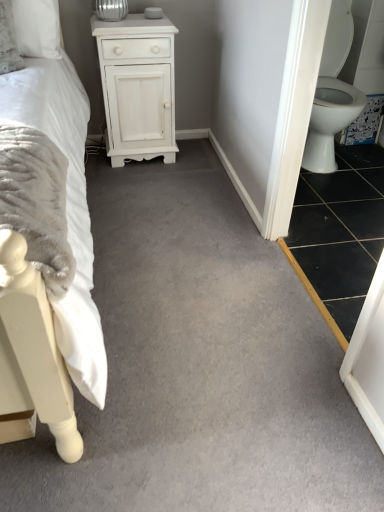
Question: Is white soft bed at left smaller than black tile at lower right?

Choices:
 (A) yes
 (B) no

Answer: (B)

Question: Is white soft bed at left not inside black tile at lower right?

Choices:
 (A) no
 (B) yes

Answer: (B)

Question: Is white soft bed at left thinner than black tile at lower right?

Choices:
 (A) yes
 (B) no

Answer: (B)

Question: Can you confirm if white soft bed at left is positioned to the right of black tile at lower right?

Choices:
 (A) yes
 (B) no

Answer: (B)

Question: From a real-world perspective, is white soft bed at left under black tile at lower right?

Choices:
 (A) yes
 (B) no

Answer: (B)

Question: Considering the relative positions of white soft bed at left and black tile at lower right in the image provided, is white soft bed at left in front of black tile at lower right?

Choices:
 (A) yes
 (B) no

Answer: (A)

Question: From the image's perspective, would you say black tile at lower right is shown under white matte cabinet at upper center?

Choices:
 (A) yes
 (B) no

Answer: (A)

Question: Is black tile at lower right facing away from white matte cabinet at upper center?

Choices:
 (A) no
 (B) yes

Answer: (A)

Question: Is black tile at lower right oriented towards white matte cabinet at upper center?

Choices:
 (A) no
 (B) yes

Answer: (A)

Question: Does black tile at lower right have a larger size compared to white matte cabinet at upper center?

Choices:
 (A) yes
 (B) no

Answer: (B)

Question: Does black tile at lower right have a lesser width compared to white matte cabinet at upper center?

Choices:
 (A) yes
 (B) no

Answer: (B)

Question: Is black tile at lower right not close to white matte cabinet at upper center?

Choices:
 (A) no
 (B) yes

Answer: (B)

Question: From a real-world perspective, is white soft bed at left positioned over white glossy toilet at right based on gravity?

Choices:
 (A) yes
 (B) no

Answer: (A)